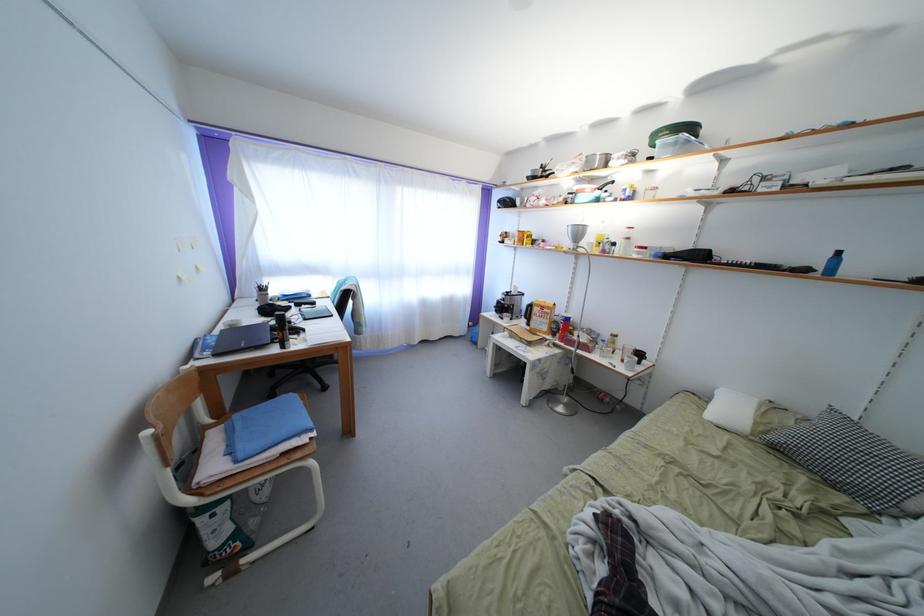
The width and height of the screenshot is (924, 616). Describe the element at coordinates (576, 233) in the screenshot. I see `a silver floor lamp shade` at that location.